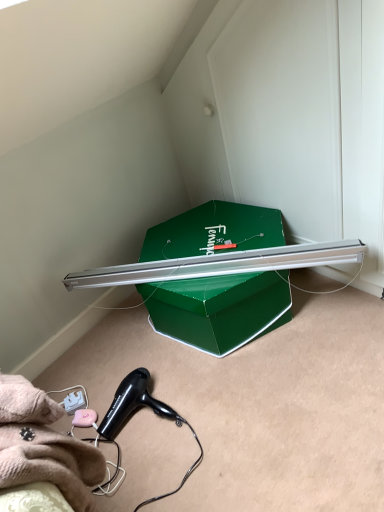
The height and width of the screenshot is (512, 384). Identify the location of black plastic hair dryer at lower left. (132, 403).

This screenshot has width=384, height=512. What do you see at coordinates (132, 403) in the screenshot?
I see `black plastic hair dryer at lower left` at bounding box center [132, 403].

The width and height of the screenshot is (384, 512). Describe the element at coordinates (219, 309) in the screenshot. I see `green cardboard box at center` at that location.

You are a GUI agent. You are given a task and a screenshot of the screen. Output one action in this format:
    pyautogui.click(x=<x>, y=<y>)
    Task: Click on the green cardboard box at center
    This screenshot has width=384, height=512.
    Given the screenshot: What is the action you would take?
    pyautogui.click(x=219, y=309)

What is the approximate width of green cardboard box at center?

green cardboard box at center is 23.47 inches wide.

Locate an element on the screen. This screenshot has width=384, height=512. black plastic hair dryer at lower left is located at coordinates (132, 403).

Is black plastic hair dryer at lower left at the right side of green cardboard box at center?

In fact, black plastic hair dryer at lower left is to the left of green cardboard box at center.

Does black plastic hair dryer at lower left come in front of green cardboard box at center?

Yes, black plastic hair dryer at lower left is closer to the camera.

Which point is more distant from viewer, (180, 421) or (224, 234)?

The point (224, 234) is farther from the camera.

Consider the image. From the image's perspective, is black plastic hair dryer at lower left over green cardboard box at center?

No, from the image's perspective, black plastic hair dryer at lower left is not over green cardboard box at center.

Looking at this image, from a real-world perspective, is black plastic hair dryer at lower left physically located above or below green cardboard box at center?

black plastic hair dryer at lower left is situated lower than green cardboard box at center in the real world.

Which of these two, black plastic hair dryer at lower left or green cardboard box at center, is wider?

green cardboard box at center.

Based on the photo, considering the sizes of black plastic hair dryer at lower left and green cardboard box at center in the image, is black plastic hair dryer at lower left taller or shorter than green cardboard box at center?

black plastic hair dryer at lower left is shorter than green cardboard box at center.

Considering the sizes of black plastic hair dryer at lower left and green cardboard box at center in the image, is black plastic hair dryer at lower left bigger or smaller than green cardboard box at center?

Clearly, black plastic hair dryer at lower left is smaller in size than green cardboard box at center.

Which is correct: black plastic hair dryer at lower left is inside green cardboard box at center, or outside of it?

black plastic hair dryer at lower left is not inside green cardboard box at center, it's outside.

Is black plastic hair dryer at lower left not close to green cardboard box at center?

Actually, black plastic hair dryer at lower left and green cardboard box at center are a little close together.

Does black plastic hair dryer at lower left turn towards green cardboard box at center?

No, black plastic hair dryer at lower left is not aimed at green cardboard box at center.

In the scene shown: What's the angular difference between black plastic hair dryer at lower left and green cardboard box at center's facing directions?

13.4 degrees.

I want to click on box above the black plastic hair dryer at lower left (from a real-world perspective), so click(219, 309).

Considering the positions of objects green cardboard box at center and black plastic hair dryer at lower left in the image provided, who is more to the left, green cardboard box at center or black plastic hair dryer at lower left?

Positioned to the left is black plastic hair dryer at lower left.

Which object is closer to the camera taking this photo, green cardboard box at center or black plastic hair dryer at lower left?

black plastic hair dryer at lower left is closer to the camera.

Does point (165, 237) lie in front of point (146, 374)?

No, it is not.

From the image's perspective, is green cardboard box at center below black plastic hair dryer at lower left?

No, from the image's perspective, green cardboard box at center is not beneath black plastic hair dryer at lower left.

From a real-world perspective, between green cardboard box at center and black plastic hair dryer at lower left, who is vertically higher?

green cardboard box at center is physically above.

Which of these two, green cardboard box at center or black plastic hair dryer at lower left, is thinner?

black plastic hair dryer at lower left.

Does green cardboard box at center have a lesser height compared to black plastic hair dryer at lower left?

In fact, green cardboard box at center may be taller than black plastic hair dryer at lower left.

Considering the sizes of objects green cardboard box at center and black plastic hair dryer at lower left in the image provided, who is bigger, green cardboard box at center or black plastic hair dryer at lower left?

green cardboard box at center is bigger.

Is green cardboard box at center positioned beyond the bounds of black plastic hair dryer at lower left?

green cardboard box at center lies outside black plastic hair dryer at lower left's area.

Is green cardboard box at center far from black plastic hair dryer at lower left?

green cardboard box at center is near black plastic hair dryer at lower left, not far away.

Is black plastic hair dryer at lower left at the back of green cardboard box at center?

No, green cardboard box at center is not facing away from black plastic hair dryer at lower left.

Can you tell me how much green cardboard box at center and black plastic hair dryer at lower left differ in facing direction?

The facing directions of green cardboard box at center and black plastic hair dryer at lower left are 13.4 degrees apart.

Find the location of a particular element. Image resolution: width=384 pixels, height=512 pixels. hair drier in front of the green cardboard box at center is located at coordinates (132, 403).

This screenshot has height=512, width=384. Find the location of `hair drier below the green cardboard box at center (from the image's perspective)`. hair drier below the green cardboard box at center (from the image's perspective) is located at coordinates (132, 403).

Where is `box located behind the black plastic hair dryer at lower left`? Image resolution: width=384 pixels, height=512 pixels. box located behind the black plastic hair dryer at lower left is located at coordinates (219, 309).